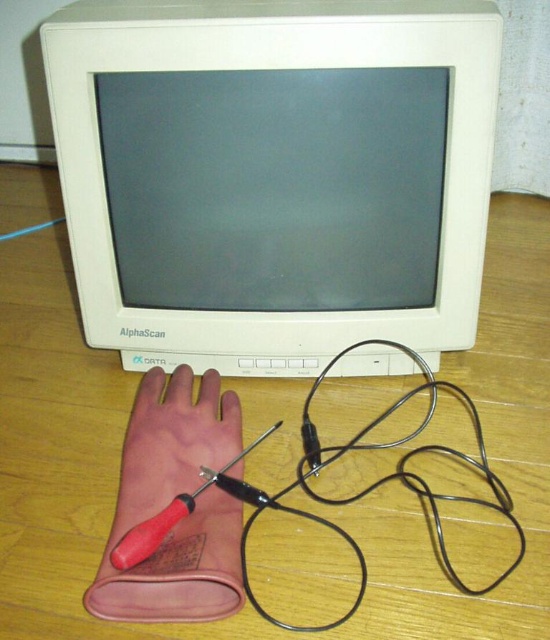
Which is in front, point (399, 465) or point (211, 448)?

Point (211, 448)

Measure the distance between black metallic wire at lower center and brown leather glove at lower left.

6.46 inches

Measure the distance between black metallic wire at lower center and camera.

black metallic wire at lower center is 24.03 inches away from camera.

Find the location of a particular element. The width and height of the screenshot is (550, 640). black metallic wire at lower center is located at coordinates (382, 483).

Which is in front, point (26, 307) or point (133, 525)?

Point (133, 525)

Who is positioned more to the left, wooden table at center or brown leather glove at lower left?

Positioned to the left is brown leather glove at lower left.

Find the location of a particular element. Image resolution: width=550 pixels, height=640 pixels. wooden table at center is located at coordinates (288, 493).

Locate an element on the screen. wooden table at center is located at coordinates (288, 493).

Is wooden table at center positioned behind black metallic wire at lower center?

No, wooden table at center is in front of black metallic wire at lower center.

Is point (363, 534) closer to viewer compared to point (425, 493)?

Yes, point (363, 534) is closer to viewer.

Where is `wooden table at center`? wooden table at center is located at coordinates (288, 493).